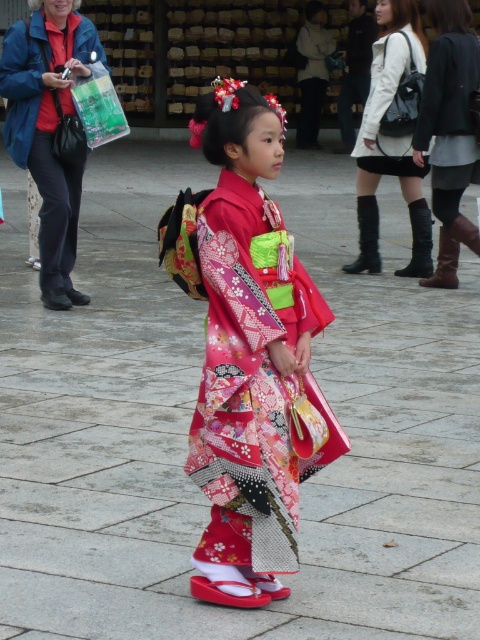
Can you confirm if matte blue jacket at upper left is positioned above white leather dress at upper center?

Incorrect, matte blue jacket at upper left is not positioned above white leather dress at upper center.

Is point (71, 228) positioned before point (371, 88)?

Yes, it is in front of point (371, 88).

Find the location of a particular element. The height and width of the screenshot is (640, 480). matte blue jacket at upper left is located at coordinates (48, 129).

Is silky kimono at center to the right of white leather jacket at upper center from the viewer's perspective?

In fact, silky kimono at center is to the left of white leather jacket at upper center.

Identify the location of silky kimono at center. (248, 353).

Who is more forward, (48, 97) or (414, 64)?

Point (48, 97) is in front.

Image resolution: width=480 pixels, height=640 pixels. In order to click on matte blue jacket at upper left in this screenshot , I will do `click(48, 129)`.

This screenshot has width=480, height=640. What do you see at coordinates (48, 129) in the screenshot? I see `matte blue jacket at upper left` at bounding box center [48, 129].

At what (x,y) coordinates should I click in order to perform the action: click on matte blue jacket at upper left. Please return your answer as a coordinate pair (x, y). The image size is (480, 640). Looking at the image, I should click on (48, 129).